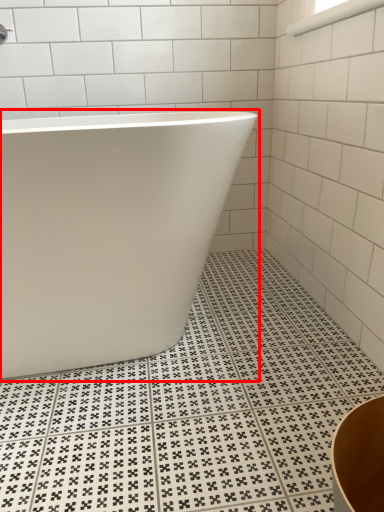
Question: Observing the image, what is the correct spatial positioning of bathtub (annotated by the red box) in reference to window?

Choices:
 (A) right
 (B) left

Answer: (B)